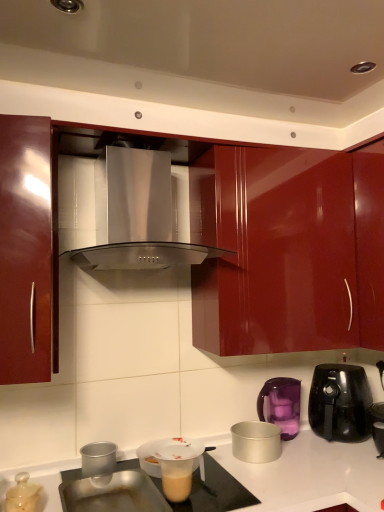
Question: Is silver metallic pot at lower center, the 3th kitchen appliance from the right, taller than black glossy air fryer at right, acting as the 1th kitchen appliance starting from the right?

Choices:
 (A) yes
 (B) no

Answer: (B)

Question: Does silver metallic pot at lower center, positioned as the 3th kitchen appliance in left-to-right order, have a smaller size compared to black glossy air fryer at right, acting as the 1th kitchen appliance starting from the right?

Choices:
 (A) no
 (B) yes

Answer: (B)

Question: Can you confirm if silver metallic pot at lower center, positioned as the 3th kitchen appliance in left-to-right order, is thinner than black glossy air fryer at right, acting as the 1th kitchen appliance starting from the right?

Choices:
 (A) yes
 (B) no

Answer: (A)

Question: Could you tell me if silver metallic pot at lower center, the 3th kitchen appliance from the right, is turned towards black glossy air fryer at right, the 5th kitchen appliance positioned from the left?

Choices:
 (A) yes
 (B) no

Answer: (B)

Question: From a real-world perspective, is silver metallic pot at lower center, positioned as the 3th kitchen appliance in left-to-right order, positioned over black glossy air fryer at right, acting as the 1th kitchen appliance starting from the right, based on gravity?

Choices:
 (A) yes
 (B) no

Answer: (B)

Question: Is silver metallic pot at lower center, positioned as the 3th kitchen appliance in left-to-right order, further to the viewer compared to black glossy air fryer at right, the 5th kitchen appliance positioned from the left?

Choices:
 (A) no
 (B) yes

Answer: (A)

Question: Considering the relative sizes of purple plastic kettle at right, which is the fourth kitchen appliance from left to right, and translucent plastic cup at lower center in the image provided, is purple plastic kettle at right, which is the fourth kitchen appliance from left to right, bigger than translucent plastic cup at lower center?

Choices:
 (A) no
 (B) yes

Answer: (B)

Question: Is purple plastic kettle at right, which is the fourth kitchen appliance from left to right, touching translucent plastic cup at lower center?

Choices:
 (A) yes
 (B) no

Answer: (B)

Question: From the image's perspective, is purple plastic kettle at right, positioned as the second kitchen appliance in right-to-left order, beneath translucent plastic cup at lower center?

Choices:
 (A) yes
 (B) no

Answer: (B)

Question: Considering the relative positions of purple plastic kettle at right, positioned as the second kitchen appliance in right-to-left order, and translucent plastic cup at lower center in the image provided, is purple plastic kettle at right, positioned as the second kitchen appliance in right-to-left order, behind translucent plastic cup at lower center?

Choices:
 (A) no
 (B) yes

Answer: (B)

Question: Is purple plastic kettle at right, positioned as the second kitchen appliance in right-to-left order, to the right of translucent plastic cup at lower center from the viewer's perspective?

Choices:
 (A) no
 (B) yes

Answer: (B)

Question: Is purple plastic kettle at right, positioned as the second kitchen appliance in right-to-left order, surrounding translucent plastic cup at lower center?

Choices:
 (A) yes
 (B) no

Answer: (B)

Question: Is purple plastic kettle at right, positioned as the second kitchen appliance in right-to-left order, bigger than translucent plastic lid at lower left, marked as the 1th kitchen appliance in a left-to-right arrangement?

Choices:
 (A) no
 (B) yes

Answer: (B)